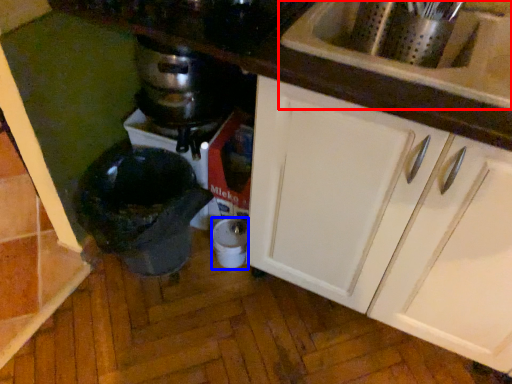
Question: Which object is closer to the camera taking this photo, sink (highlighted by a red box) or appliance (highlighted by a blue box)?

Choices:
 (A) sink
 (B) appliance

Answer: (A)